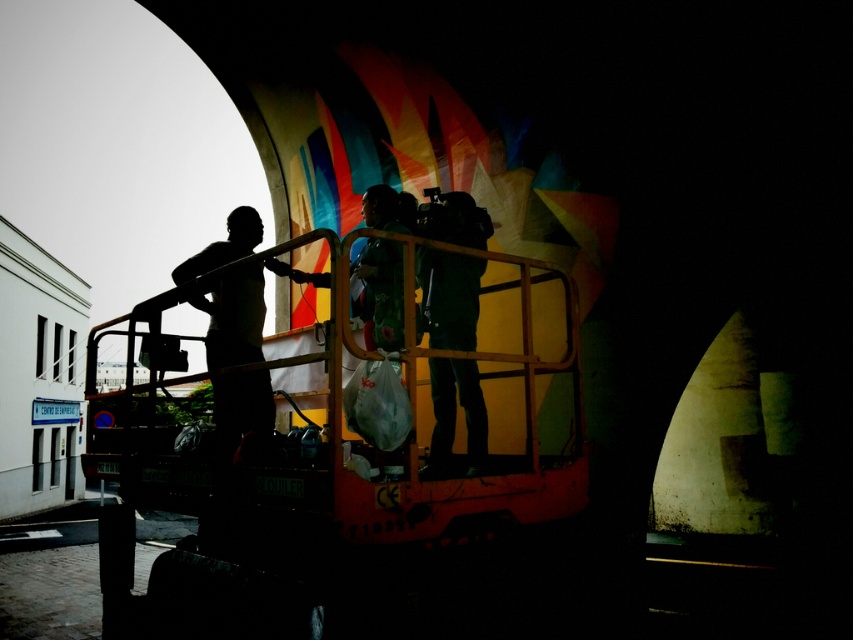
Does point (554, 509) come closer to viewer compared to point (474, 380)?

Yes, it is.

Does metallic yellow truck at center appear on the right side of dark green fabric at center?

In fact, metallic yellow truck at center is to the left of dark green fabric at center.

Is point (129, 600) positioned before point (474, 224)?

No, (129, 600) is behind (474, 224).

The width and height of the screenshot is (853, 640). What are the coordinates of `metallic yellow truck at center` in the screenshot? It's located at (323, 499).

Is dark green fabric at center below silhouette man at left?

Actually, dark green fabric at center is above silhouette man at left.

Which is in front, point (460, 259) or point (234, 426)?

Point (234, 426) is more forward.

Where is `dark green fabric at center`? This screenshot has width=853, height=640. dark green fabric at center is located at coordinates (450, 298).

Is metallic yellow truck at center taller than silhouette man at left?

Yes.

Consider the image. Is metallic yellow truck at center thinner than silhouette man at left?

In fact, metallic yellow truck at center might be wider than silhouette man at left.

Is point (575, 428) positioned before point (189, 268)?

Yes.

In order to click on metallic yellow truck at center in this screenshot , I will do click(323, 499).